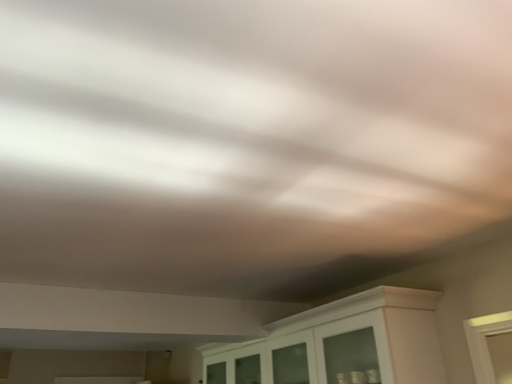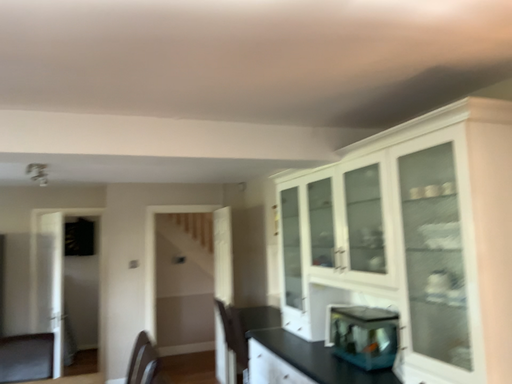
Question: How did the camera likely rotate when shooting the video?

Choices:
 (A) rotated right
 (B) rotated left

Answer: (B)